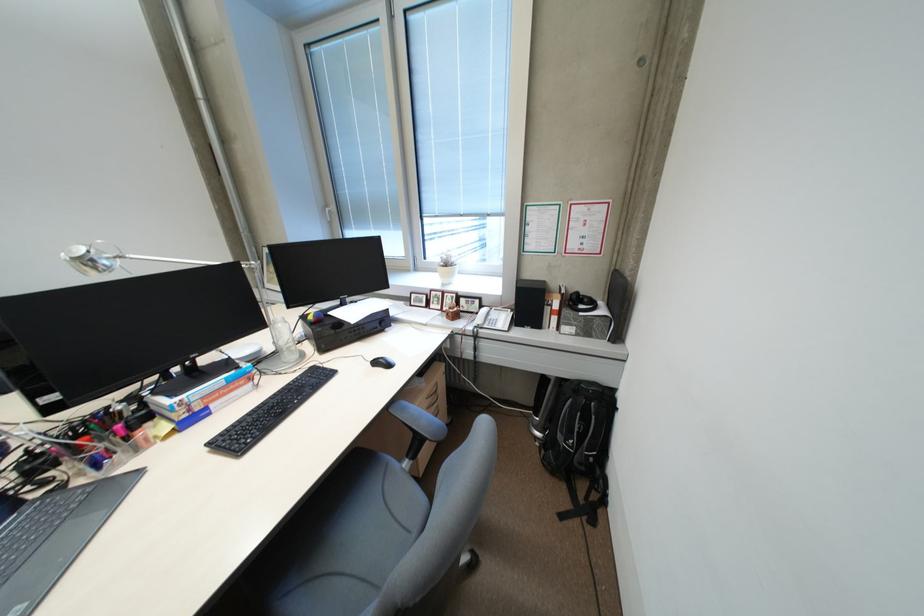
You are a GUI agent. You are given a task and a screenshot of the screen. Output one action in this format:
    pyautogui.click(x=<x>, y=<y>)
    Task: Click on the drawer handle
    
    Given the screenshot: What is the action you would take?
    pyautogui.click(x=433, y=398)